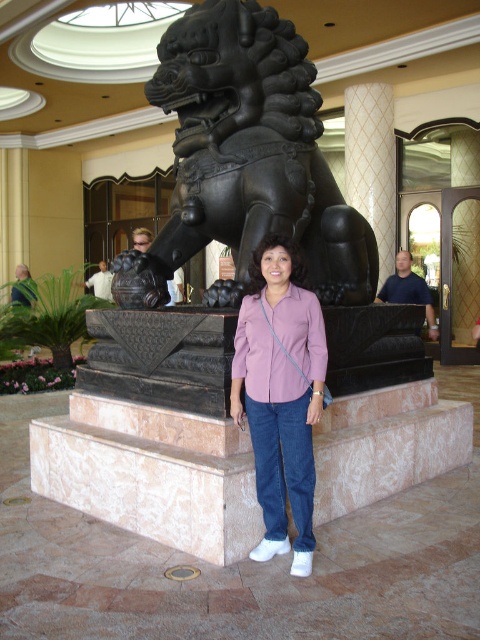
You are a photographer trying to frame a shot of the black bronze lion at center and the matte purple shirt at center. Which object should you focus on first if you want to capture both in a single frame without zooming in or out?

You should focus on the black bronze lion at center first because it is wider than the matte purple shirt at center, so positioning it properly will ensure both fit in the frame.

You are a photographer trying to capture a photo of the black bronze lion at center and the pink fabric shirt at center. Since you want both subjects to appear balanced in the frame, which subject should you move closer to the camera to achieve this?

The pink fabric shirt at center should be moved closer to the camera because it is smaller in size than the black bronze lion at center, so bringing it nearer would help balance their sizes in the photo.

You are standing at the entrance of the hotel lobby and see two points marked in the scene. The first point is at coordinates point (245, 115) and the second point is at point (311, 365). Which point is closer to the entrance?

Point (311, 365) is closer to the entrance because point (245, 115) is behind it.